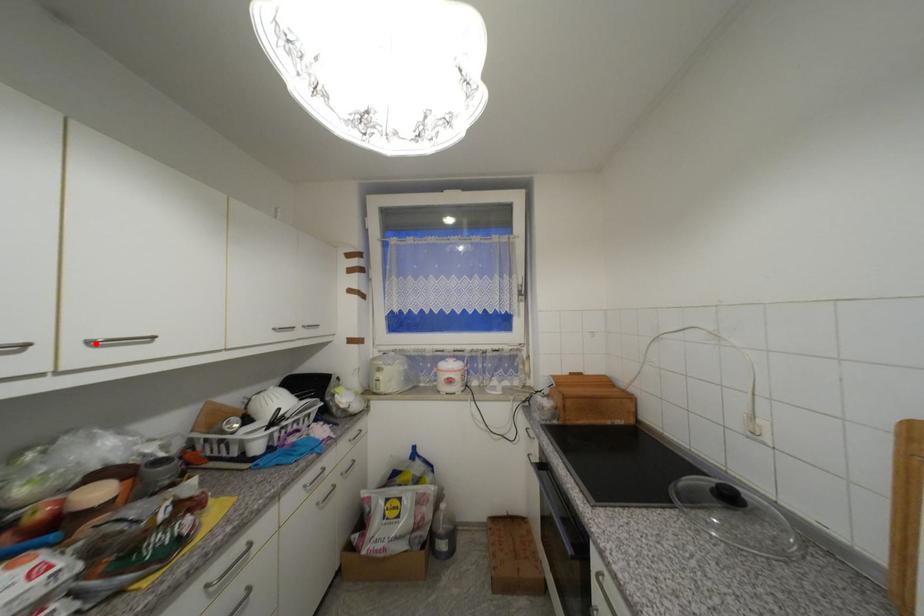
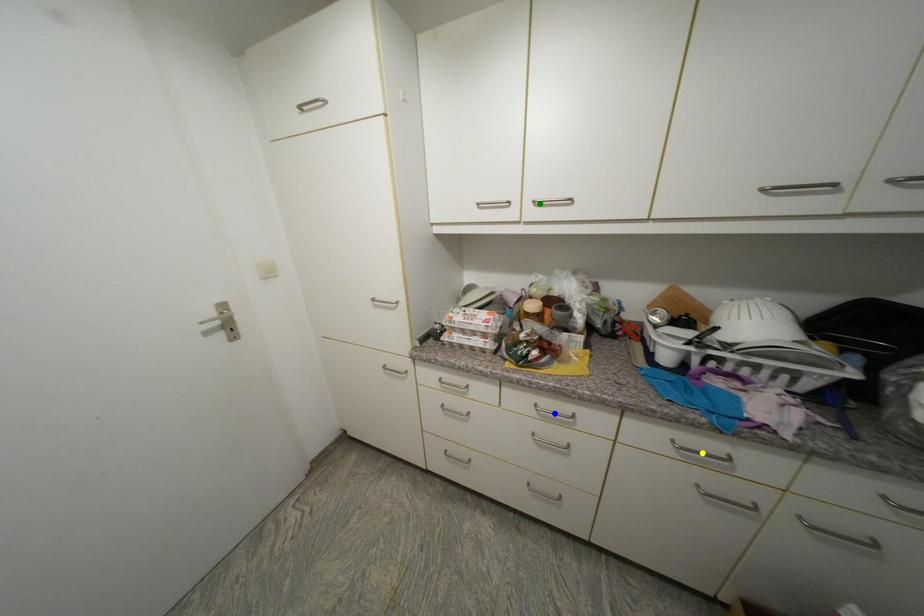
Question: I am providing you with two images of the same scene from different viewpoints. A red point is marked on the first image. You are given multiple points on the second image. Which mark in image 2 goes with the point in image 1?

Choices:
 (A) yellow point
 (B) blue point
 (C) green point

Answer: (C)